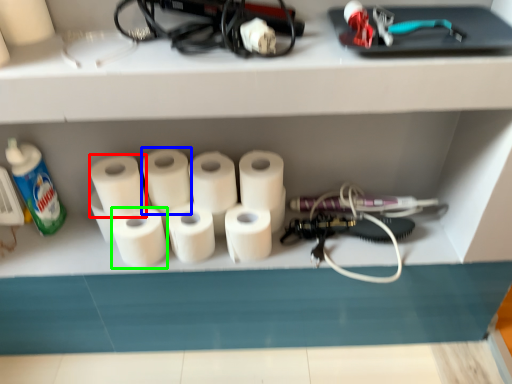
Question: Which is farther away from toilet paper (highlighted by a red box)? toilet paper (highlighted by a blue box) or toilet paper (highlighted by a green box)?

Choices:
 (A) toilet paper
 (B) toilet paper

Answer: (B)